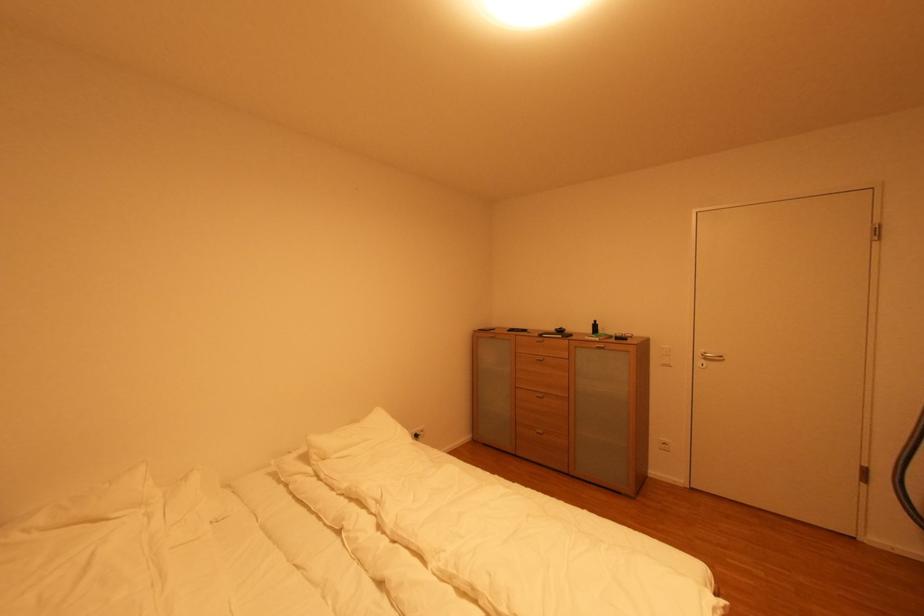
You are a GUI agent. You are given a task and a screenshot of the screen. Output one action in this format:
    pyautogui.click(x=<x>, y=<y>)
    Task: Click on the pair of eyeglasses
    
    Given the screenshot: What is the action you would take?
    pyautogui.click(x=625, y=339)